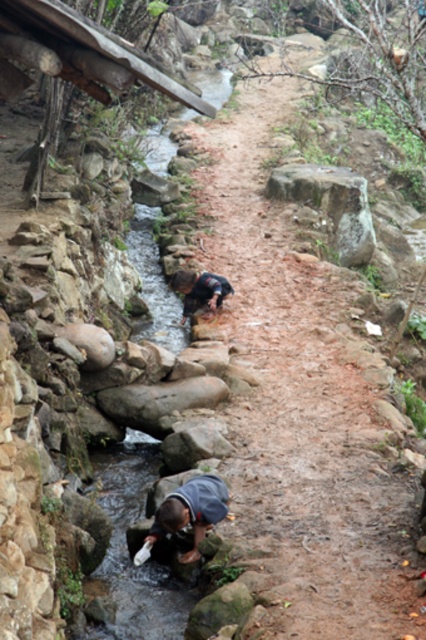
You are a hiker who needs to cross the stream. You see the gray rough rock at upper center and the dark blue fabric at center. Which object is higher up the stream and can help you navigate?

The gray rough rock at upper center is taller than the dark blue fabric at center, so it is higher up the stream and can help you navigate.

You are standing at the point marked as point (190,512) in the image. What is located at this point?

The point (190,512) corresponds to gray fabric at lower center.

You are a hiker who wants to cross the stream using the stone wall. You see the gray rough rock at upper center and the dark blue fabric at center. Which object is closer to you as you approach the stream from the dirt path?

The gray rough rock at upper center is closer to you because it is further to the viewer than the dark blue fabric at center, meaning it appears nearer in your line of sight.